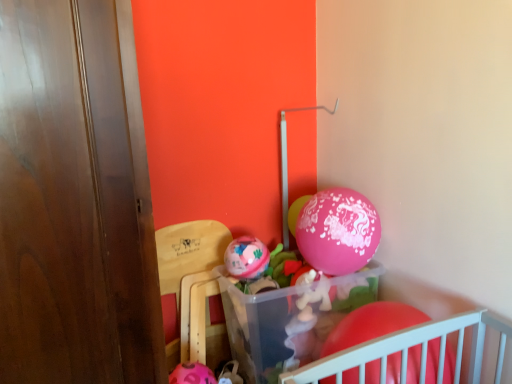
Question: Which direction should I rotate to look at pink glossy balloon at center, which is the third balloon from front to back?

Choices:
 (A) right
 (B) left

Answer: (A)

Question: From the image's perspective, does matte pink balloon at center, the 3th balloon viewed from the right, appear higher than rubber matte balloon at lower right, which is the first balloon from front to back?

Choices:
 (A) yes
 (B) no

Answer: (A)

Question: Is matte pink balloon at center, arranged as the second balloon when viewed from the front, facing towards rubber matte balloon at lower right, the third balloon when ordered from left to right?

Choices:
 (A) no
 (B) yes

Answer: (A)

Question: Does matte pink balloon at center, placed as the first balloon when sorted from left to right, have a lesser width compared to rubber matte balloon at lower right, which is the 1th balloon from right to left?

Choices:
 (A) no
 (B) yes

Answer: (B)

Question: From a real-world perspective, is matte pink balloon at center, the 2th balloon when ordered from bottom to top, physically above rubber matte balloon at lower right, marked as the 1th balloon in a bottom-to-top arrangement?

Choices:
 (A) no
 (B) yes

Answer: (B)

Question: Is matte pink balloon at center, arranged as the second balloon when viewed from the front, in contact with rubber matte balloon at lower right, the third balloon viewed from the top?

Choices:
 (A) yes
 (B) no

Answer: (B)

Question: Is matte pink balloon at center, which is the 2th balloon in top-to-bottom order, further to camera compared to rubber matte balloon at lower right, which is the 1th balloon from right to left?

Choices:
 (A) no
 (B) yes

Answer: (B)

Question: From a real-world perspective, is pink glossy balloon at center, which ranks as the second balloon in left-to-right order, under rubber matte balloon at lower right, the third balloon when ordered from left to right?

Choices:
 (A) no
 (B) yes

Answer: (A)

Question: Is rubber matte balloon at lower right, which is the first balloon from front to back, completely or partially inside pink glossy balloon at center, which is the third balloon from front to back?

Choices:
 (A) no
 (B) yes

Answer: (A)

Question: Is pink glossy balloon at center, which is the third balloon from front to back, smaller than rubber matte balloon at lower right, the 3th balloon when ordered from back to front?

Choices:
 (A) yes
 (B) no

Answer: (A)

Question: From the image's perspective, would you say pink glossy balloon at center, the 1th balloon positioned from the back, is positioned over rubber matte balloon at lower right, the third balloon viewed from the top?

Choices:
 (A) no
 (B) yes

Answer: (B)

Question: Is pink glossy balloon at center, which ranks as the second balloon in left-to-right order, to the left of rubber matte balloon at lower right, the 3th balloon when ordered from back to front, from the viewer's perspective?

Choices:
 (A) no
 (B) yes

Answer: (B)

Question: Is pink glossy balloon at center, acting as the 3th balloon starting from the bottom, bigger than rubber matte balloon at lower right, the 3th balloon when ordered from back to front?

Choices:
 (A) yes
 (B) no

Answer: (B)

Question: Is rubber matte balloon at lower right, the third balloon when ordered from left to right, positioned beyond the bounds of wooden chair at lower left?

Choices:
 (A) no
 (B) yes

Answer: (B)